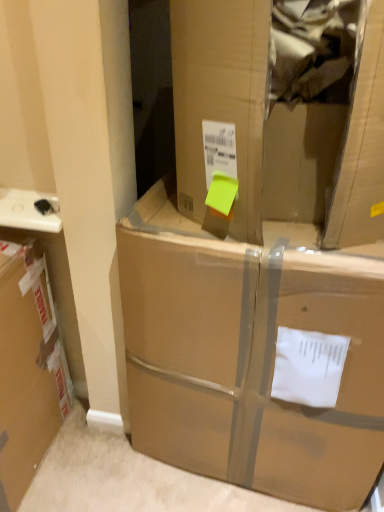
The height and width of the screenshot is (512, 384). Find the location of `brown cardboard box at center`. brown cardboard box at center is located at coordinates (282, 112).

This screenshot has height=512, width=384. What do you see at coordinates (282, 112) in the screenshot?
I see `brown cardboard box at center` at bounding box center [282, 112].

The width and height of the screenshot is (384, 512). What are the coordinates of `brown cardboard box at center` in the screenshot? It's located at (248, 356).

The image size is (384, 512). Describe the element at coordinates (248, 356) in the screenshot. I see `brown cardboard box at center` at that location.

Locate an element on the screen. brown cardboard box at center is located at coordinates (282, 112).

Is brown cardboard box at center to the left or to the right of brown cardboard box at center in the image?

Clearly, brown cardboard box at center is on the left of brown cardboard box at center in the image.

Looking at this image, which is in front, brown cardboard box at center or brown cardboard box at center?

brown cardboard box at center is in front.

Which is behind, point (345, 393) or point (382, 47)?

The point (345, 393) is farther from the camera.

From the image's perspective, would you say brown cardboard box at center is positioned over brown cardboard box at center?

No, from the image's perspective, brown cardboard box at center is not over brown cardboard box at center.

From a real-world perspective, is brown cardboard box at center physically above brown cardboard box at center?

No.

In terms of width, does brown cardboard box at center look wider or thinner when compared to brown cardboard box at center?

In the image, brown cardboard box at center appears to be wider than brown cardboard box at center.

Can you confirm if brown cardboard box at center is shorter than brown cardboard box at center?

No, brown cardboard box at center is not shorter than brown cardboard box at center.

Is brown cardboard box at center smaller than brown cardboard box at center?

No, brown cardboard box at center is not smaller than brown cardboard box at center.

Would you say brown cardboard box at center contains brown cardboard box at center?

That's incorrect, brown cardboard box at center is not inside brown cardboard box at center.

In the scene shown: Is brown cardboard box at center touching brown cardboard box at center?

brown cardboard box at center and brown cardboard box at center are not in contact.

Is brown cardboard box at center oriented away from brown cardboard box at center?

No, brown cardboard box at center is not facing the opposite direction of brown cardboard box at center.

How different are the orientations of brown cardboard box at center and brown cardboard box at center in degrees?

The angular difference between brown cardboard box at center and brown cardboard box at center is 9.35 degrees.

Where is `box that is below the brown cardboard box at center (from the image's perspective)`? The image size is (384, 512). box that is below the brown cardboard box at center (from the image's perspective) is located at coordinates (248, 356).

Can you confirm if brown cardboard box at center is positioned to the right of brown cardboard box at center?

Correct, you'll find brown cardboard box at center to the right of brown cardboard box at center.

Which object is further away from the camera taking this photo, brown cardboard box at center or brown cardboard box at center?

brown cardboard box at center is further from the camera.

Between point (289, 57) and point (192, 345), which one is positioned in front?

The point (289, 57) is closer.

From the image's perspective, would you say brown cardboard box at center is shown under brown cardboard box at center?

No, from the image's perspective, brown cardboard box at center is not below brown cardboard box at center.

From a real-world perspective, is brown cardboard box at center located beneath brown cardboard box at center?

Incorrect, from a real-world perspective, brown cardboard box at center is higher than brown cardboard box at center.

Between brown cardboard box at center and brown cardboard box at center, which one has smaller width?

brown cardboard box at center is thinner.

In terms of height, does brown cardboard box at center look taller or shorter compared to brown cardboard box at center?

brown cardboard box at center is shorter than brown cardboard box at center.

Which of these two, brown cardboard box at center or brown cardboard box at center, is bigger?

brown cardboard box at center.

Choose the correct answer: Is brown cardboard box at center inside brown cardboard box at center or outside it?

brown cardboard box at center cannot be found inside brown cardboard box at center.

Is brown cardboard box at center positioned far away from brown cardboard box at center?

Actually, brown cardboard box at center and brown cardboard box at center are a little close together.

Could you tell me if brown cardboard box at center is turned towards brown cardboard box at center?

No, brown cardboard box at center is not oriented towards brown cardboard box at center.

Can you tell me how much brown cardboard box at center and brown cardboard box at center differ in facing direction?

brown cardboard box at center and brown cardboard box at center are facing 9.35 degrees away from each other.

Image resolution: width=384 pixels, height=512 pixels. I want to click on box behind the brown cardboard box at center, so click(248, 356).

Locate an element on the screen. The width and height of the screenshot is (384, 512). box that is on the left side of brown cardboard box at center is located at coordinates (248, 356).

Find the location of a particular element. This screenshot has width=384, height=512. box located underneath the brown cardboard box at center (from a real-world perspective) is located at coordinates (248, 356).